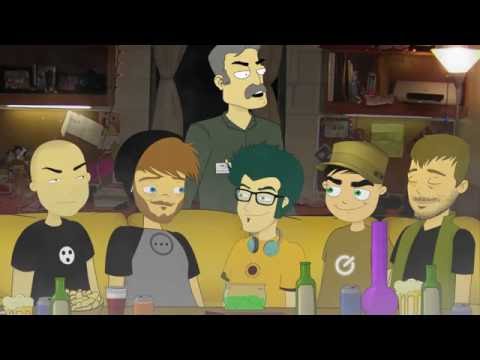
In order to click on table in this screenshot , I will do `click(190, 230)`.